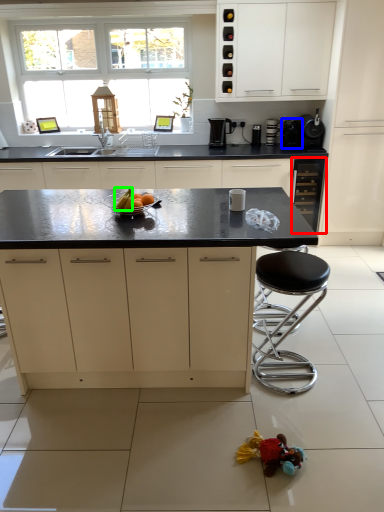
Question: Considering the real-world distances, which object is closest to cabinetry (highlighted by a red box)? appliance (highlighted by a blue box) or fruit (highlighted by a green box).

Choices:
 (A) appliance
 (B) fruit

Answer: (A)